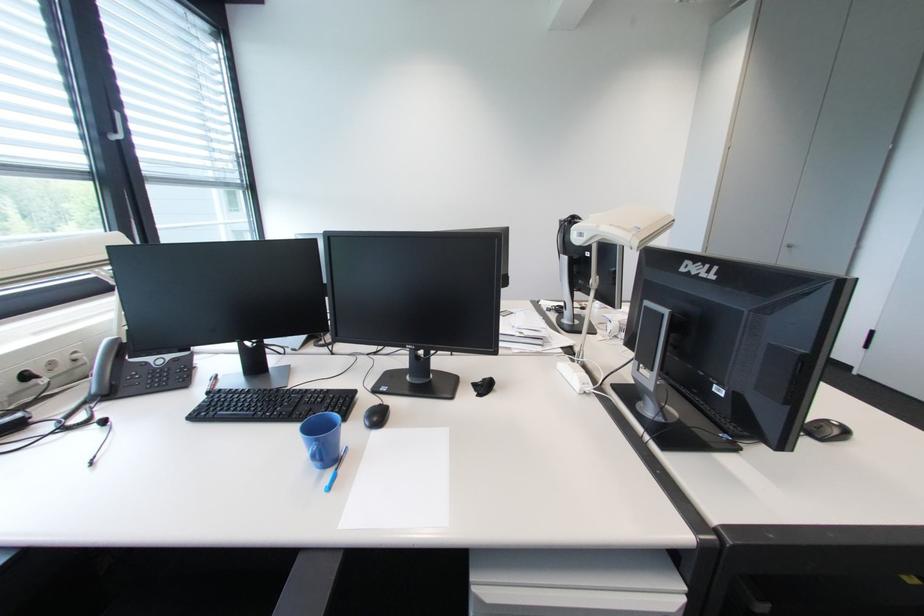
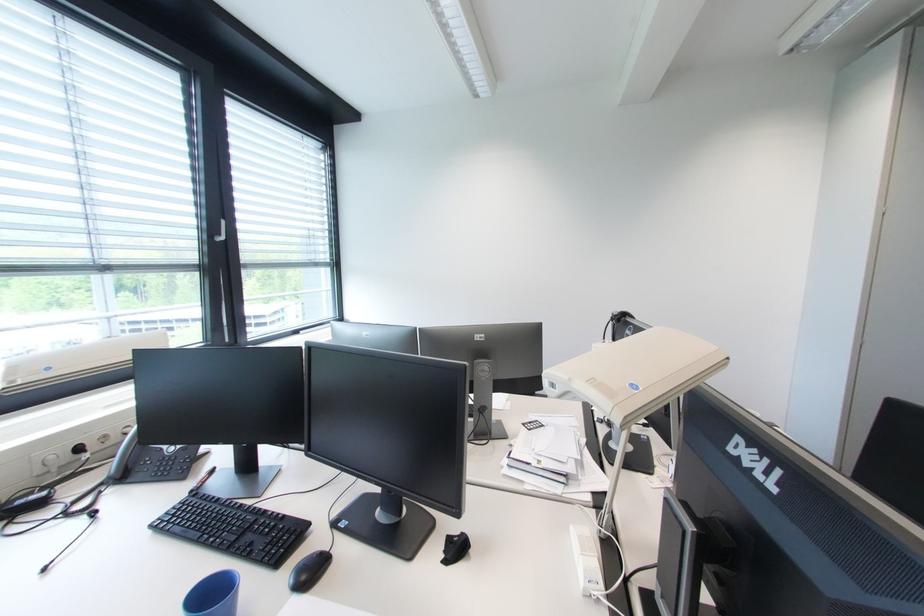
Where in the second image is the point corresponding to the point at 81,354 from the first image?

(134, 428)